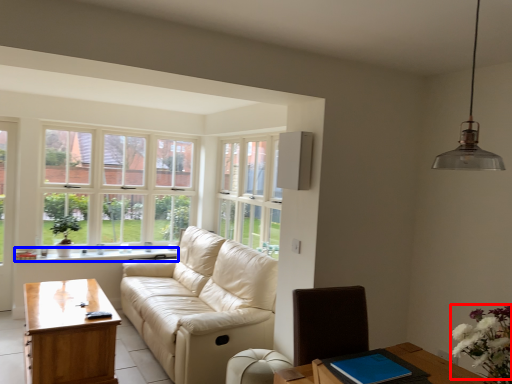
Question: Which point is further to the camera, flower (highlighted by a red box) or window sill (highlighted by a blue box)?

Choices:
 (A) flower
 (B) window sill

Answer: (B)